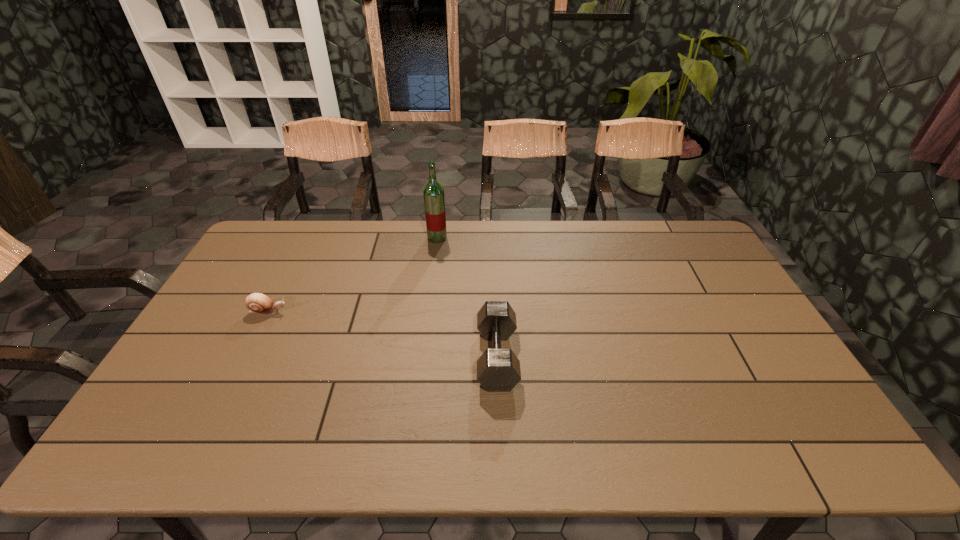
Identify the location of free space between the shortest object and the rightmost object. This screenshot has height=540, width=960. (383, 334).

Find the location of a particular element. The height and width of the screenshot is (540, 960). free space between the nearest object and the farthest object is located at coordinates (468, 298).

Image resolution: width=960 pixels, height=540 pixels. What are the coordinates of `empty space between the shortest object and the tallest object` in the screenshot? It's located at (352, 275).

Where is `vacant area between the liquor and the leftmost object`? vacant area between the liquor and the leftmost object is located at coordinates (352, 275).

This screenshot has height=540, width=960. I want to click on object that ranks as the second closest to the second tallest object, so click(x=258, y=303).

Identify the location of object that stands as the closest to the dumbbell. This screenshot has height=540, width=960. (434, 201).

This screenshot has height=540, width=960. I want to click on vacant space that satisfies the following two spatial constraints: 1. on the back side of the second tallest object; 2. on the front-facing side of the second farthest object, so click(x=495, y=312).

Locate an element on the screen. Image resolution: width=960 pixels, height=540 pixels. free location that satisfies the following two spatial constraints: 1. on the front side of the second object from right to left; 2. on the left side of the dumbbell is located at coordinates (422, 357).

I want to click on free spot that satisfies the following two spatial constraints: 1. on the front side of the liquor; 2. on the front-facing side of the escargot, so click(428, 312).

At what (x,y) coordinates should I click in order to perform the action: click on free space that satisfies the following two spatial constraints: 1. on the front side of the tallest object; 2. on the front-facing side of the shortest object. Please return your answer as a coordinate pair (x, y). The width and height of the screenshot is (960, 540). Looking at the image, I should click on (428, 312).